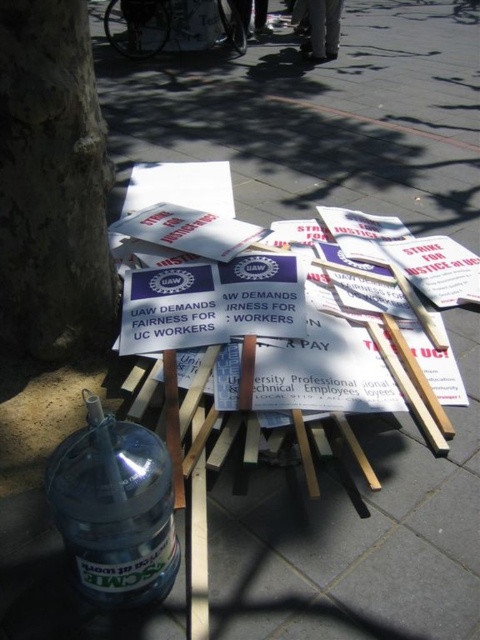
Question: Which point is farther to the camera?

Choices:
 (A) (92, 538)
 (B) (81, 300)

Answer: (B)

Question: Can you confirm if smooth bark tree at lower left is bigger than clear plastic bottle at lower left?

Choices:
 (A) yes
 (B) no

Answer: (A)

Question: Can you confirm if smooth bark tree at lower left is positioned to the right of clear plastic bottle at lower left?

Choices:
 (A) no
 (B) yes

Answer: (A)

Question: Is smooth bark tree at lower left positioned before clear plastic bottle at lower left?

Choices:
 (A) yes
 (B) no

Answer: (B)